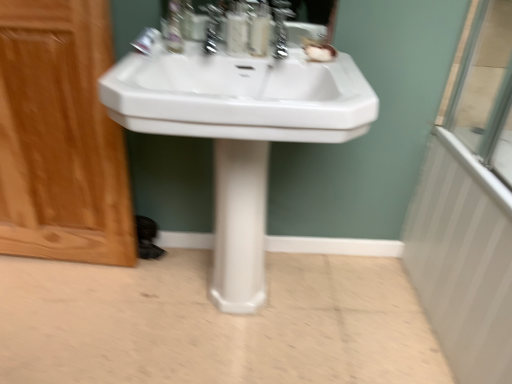
Identify the location of free area below wooden screen door at left (from a real-world perspective). This screenshot has width=512, height=384. (65, 264).